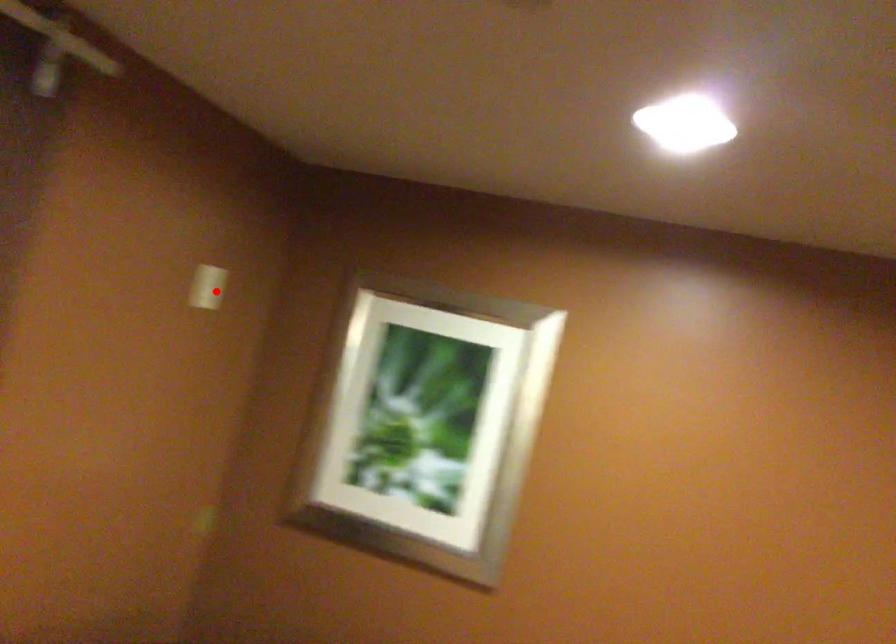
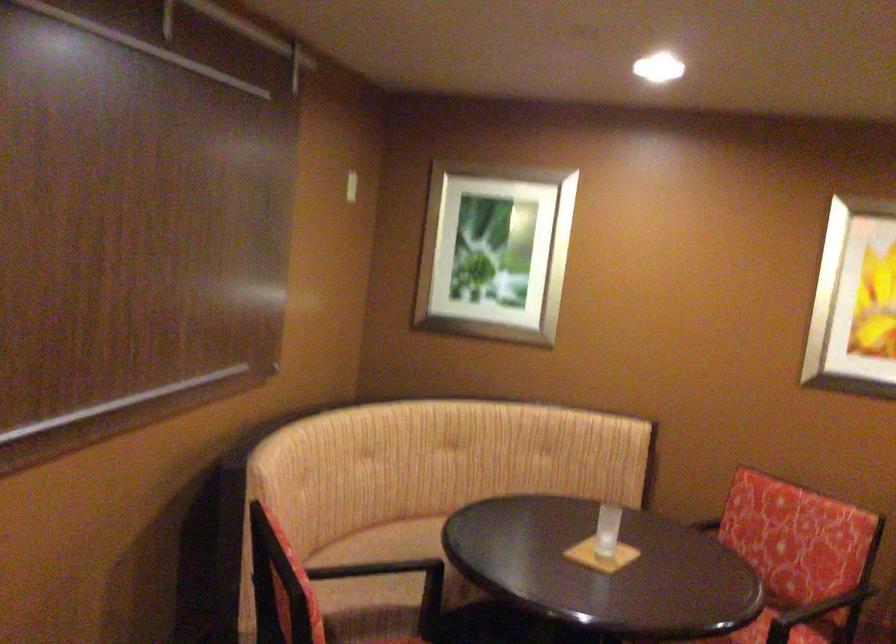
Where in the second image is the point corresponding to the highlighted location from the first image?

(350, 185)